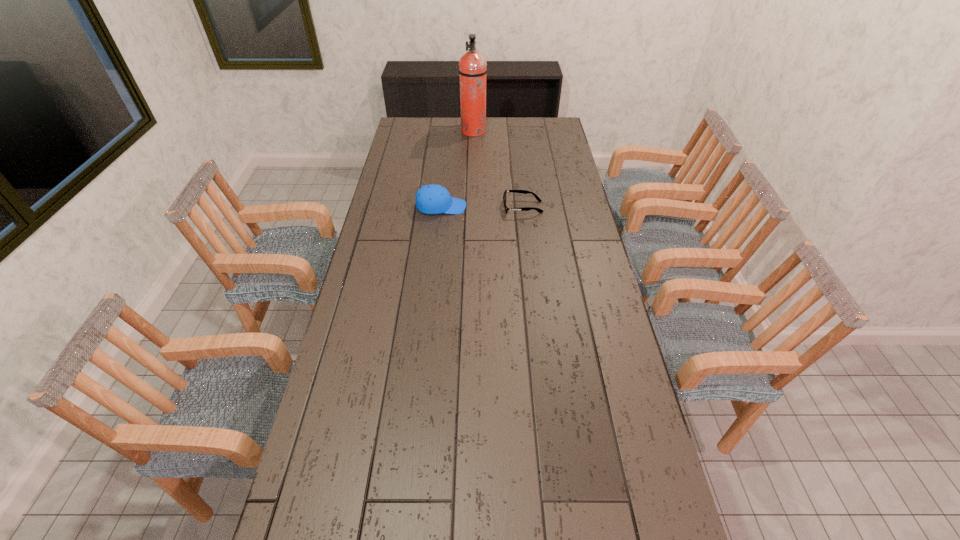
Identify which object is the nearest to the shortest object. Please provide its 2D coordinates. Your answer should be formatted as a tuple, i.e. [(x, y)], where the tuple contains the x and y coordinates of a point satisfying the conditions above.

[(430, 199)]